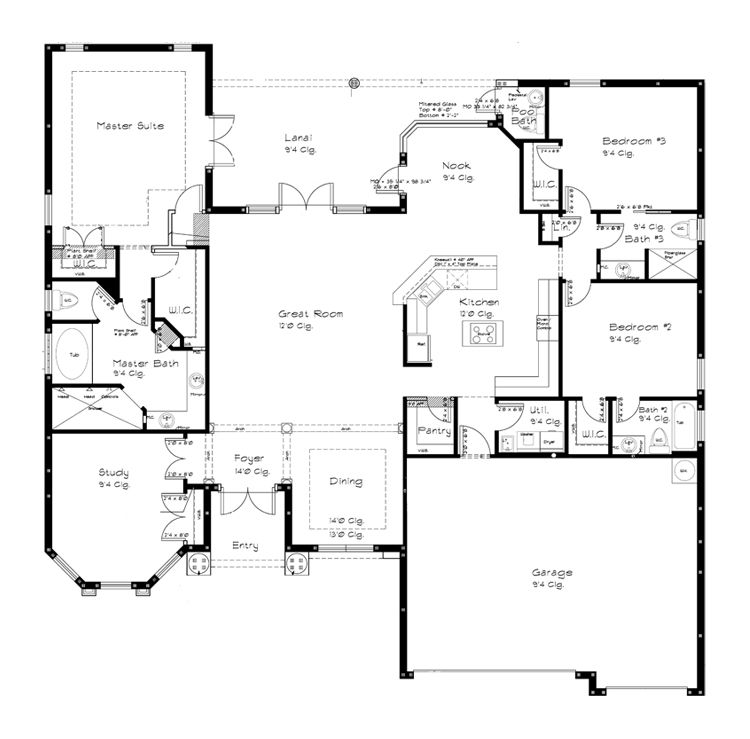
The width and height of the screenshot is (750, 739). Identify the location of bathroom. (134, 357), (528, 106), (640, 225), (664, 420).